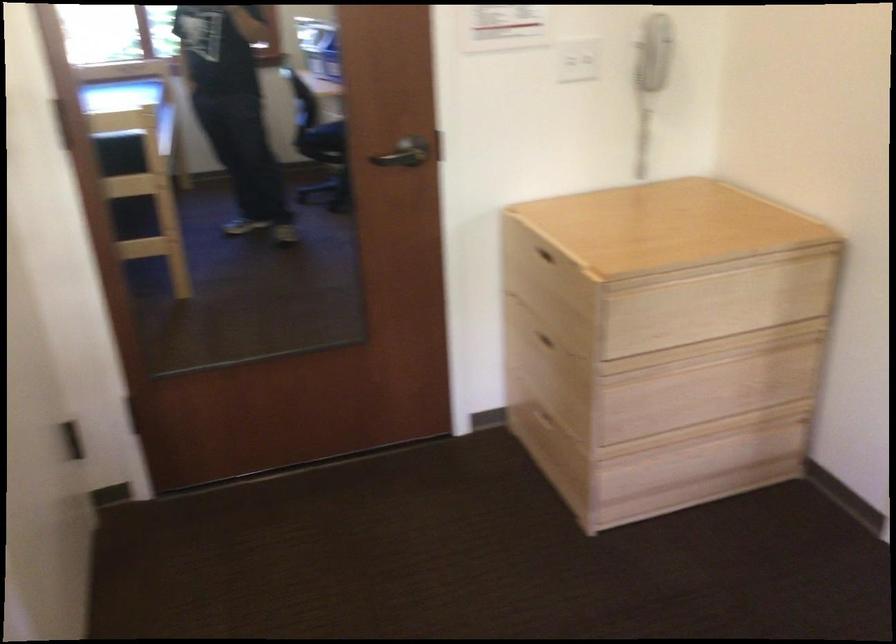
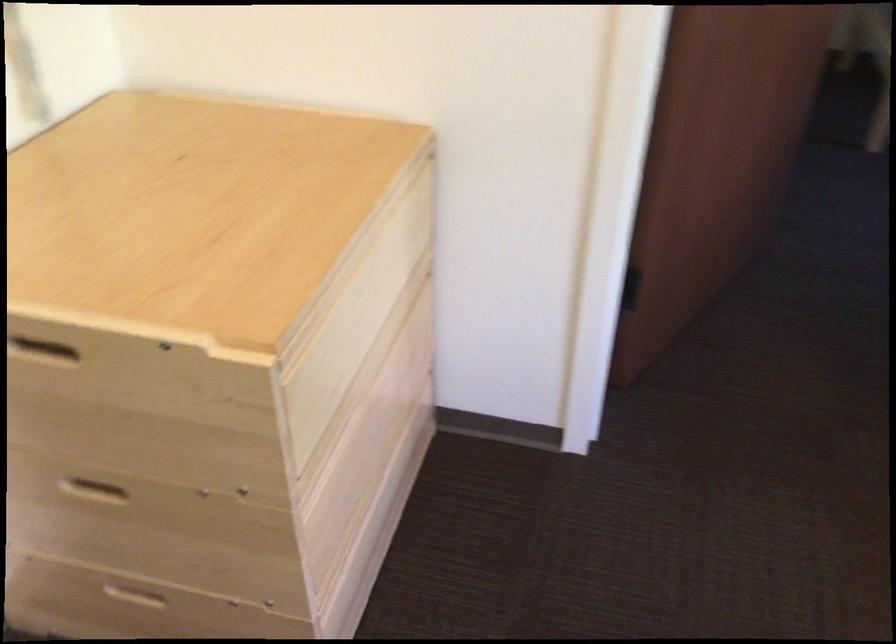
The point at (540,341) is marked in the first image. Where is the corresponding point in the second image?

(90, 488)